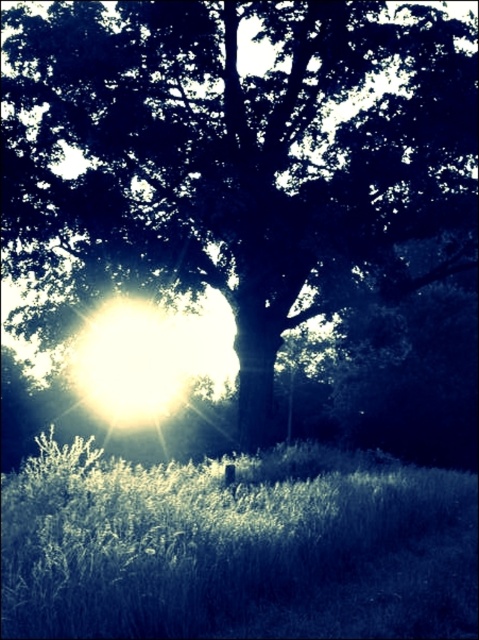
Is green leafy tree at center to the left of green grass at lower center from the viewer's perspective?

Indeed, green leafy tree at center is positioned on the left side of green grass at lower center.

Based on the photo, who is lower down, green leafy tree at center or green grass at lower center?

Positioned lower is green grass at lower center.

Is point (462, 154) closer to camera compared to point (240, 524)?

No.

Where is `green leafy tree at center`? Image resolution: width=479 pixels, height=640 pixels. green leafy tree at center is located at coordinates (235, 157).